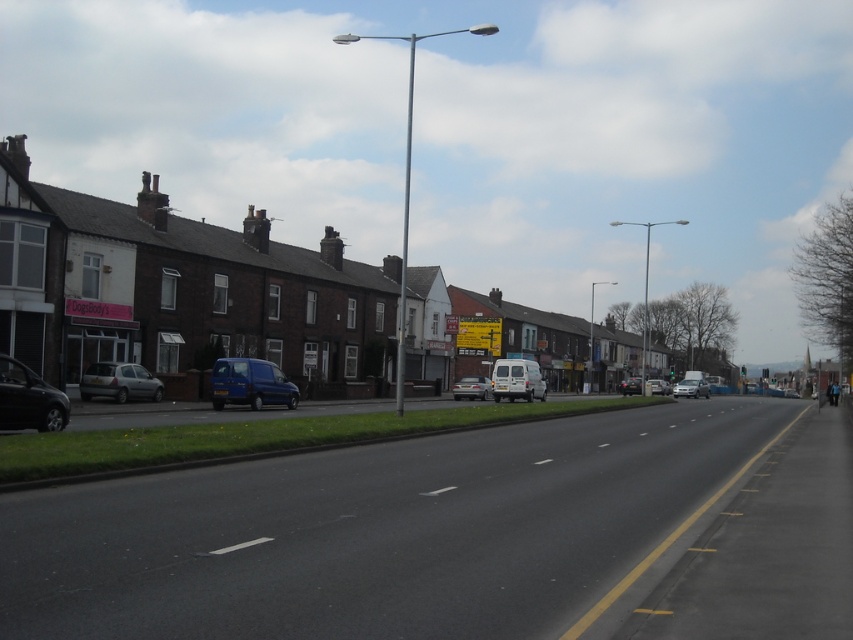
Question: Estimate the real-world distances between objects in this image. Which object is farther from the silver metallic hatchback at left?

Choices:
 (A) matte black car at center
 (B) silver metallic sedan at center

Answer: (A)

Question: Which point is farther to the camera?

Choices:
 (A) (471, 380)
 (B) (619, 388)
 (C) (247, 374)
 (D) (90, 364)

Answer: (B)

Question: Is silver metallic hatchback at left further to camera compared to matte black car at center?

Choices:
 (A) no
 (B) yes

Answer: (A)

Question: Considering the relative positions of silver metallic sedan at center and matte black car at center in the image provided, where is silver metallic sedan at center located with respect to matte black car at center?

Choices:
 (A) right
 (B) left

Answer: (A)

Question: Which object appears farthest from the camera in this image?

Choices:
 (A) silver metallic hatchback at left
 (B) shiny black car at left
 (C) white matte van at center

Answer: (C)

Question: Is shiny black car at left positioned behind metallic blue van at lower left?

Choices:
 (A) yes
 (B) no

Answer: (B)